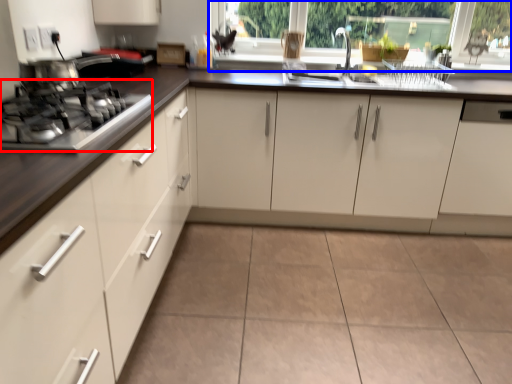
Question: Which object appears closest to the camera in this image, gas stove (highlighted by a red box) or window frame (highlighted by a blue box)?

Choices:
 (A) gas stove
 (B) window frame

Answer: (A)